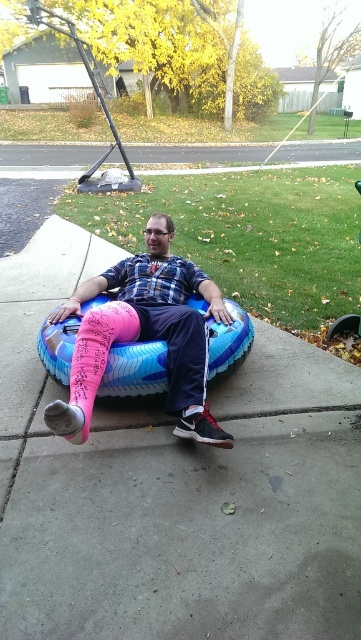
Between blue rubber tube at center and pink matte prosthetic leg at lower left, which one is positioned lower?

blue rubber tube at center is lower down.

Is blue rubber tube at center bigger than pink matte prosthetic leg at lower left?

Yes, blue rubber tube at center is bigger than pink matte prosthetic leg at lower left.

Locate an element on the screen. blue rubber tube at center is located at coordinates (174, 490).

Does pink matte prosthetic leg at lower left lie in front of green fabric bean bag chair at right?

Yes.

Between point (106, 285) and point (358, 317), which one is positioned behind?

The point (358, 317) is more distant.

Identify the location of pink matte prosthetic leg at lower left. (145, 336).

Between point (222, 305) and point (128, 355), which one is positioned behind?

The point (222, 305) is more distant.

Who is shorter, pink matte prosthetic leg at lower left or pink fabric bean bag chair at center?

pink fabric bean bag chair at center

The image size is (361, 640). In order to click on pink matte prosthetic leg at lower left in this screenshot , I will do `click(145, 336)`.

Identify the location of pink matte prosthetic leg at lower left. Image resolution: width=361 pixels, height=640 pixels. (145, 336).